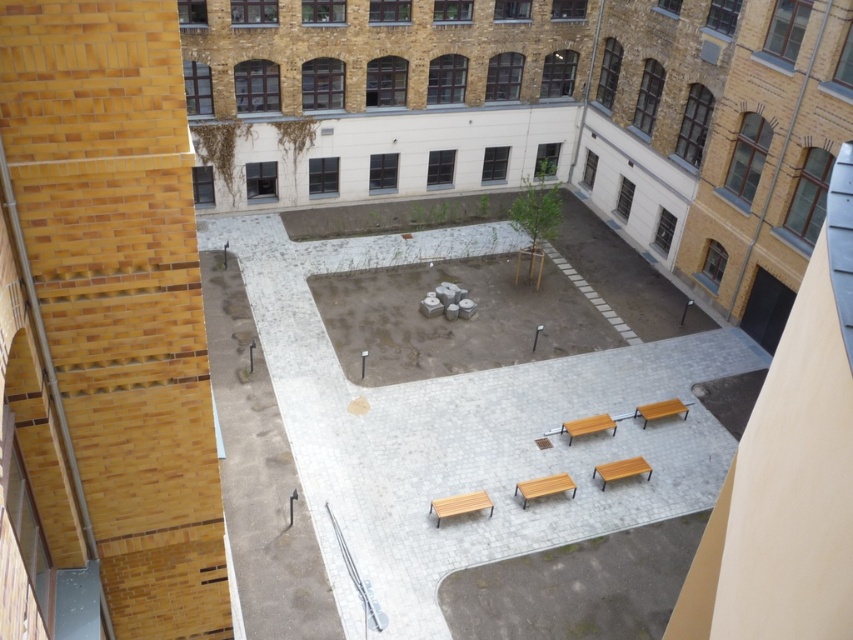
You are standing at the center of the urban courtyard and want to move towards the point labeled point (436, 508). However, there is an obstacle at point (575, 422). Will you encounter the obstacle before reaching your destination?

Point (436, 508) is in front of point (575, 422), so you will reach point (436, 508) before encountering the obstacle at point (575, 422).

You are standing in the courtyard and want to sit on the wooden bench at center. Which direction should you walk to reach it from the smooth concrete bench at center?

The smooth concrete bench at center is in front of the wooden bench at center, so you should walk backward to reach the wooden bench at center from the smooth concrete bench at center.